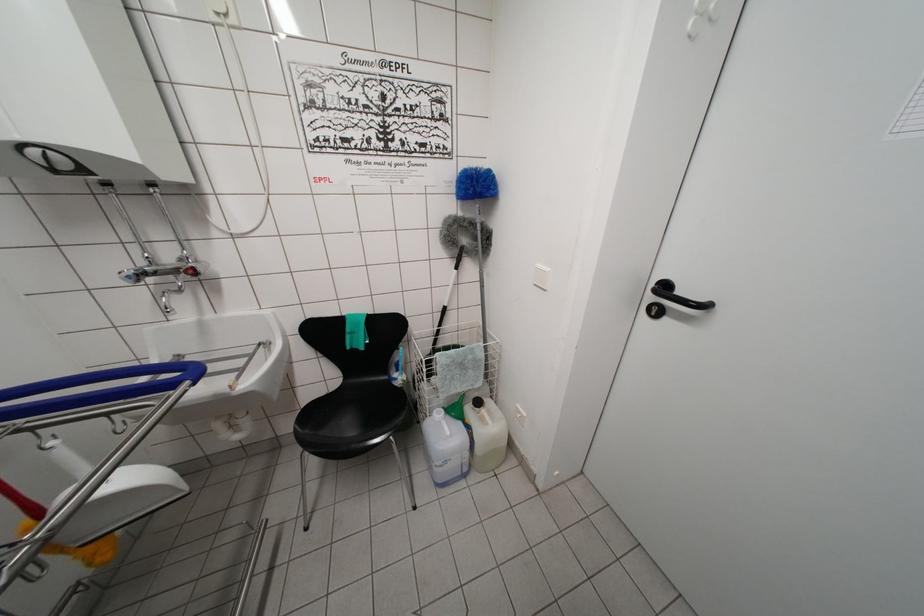
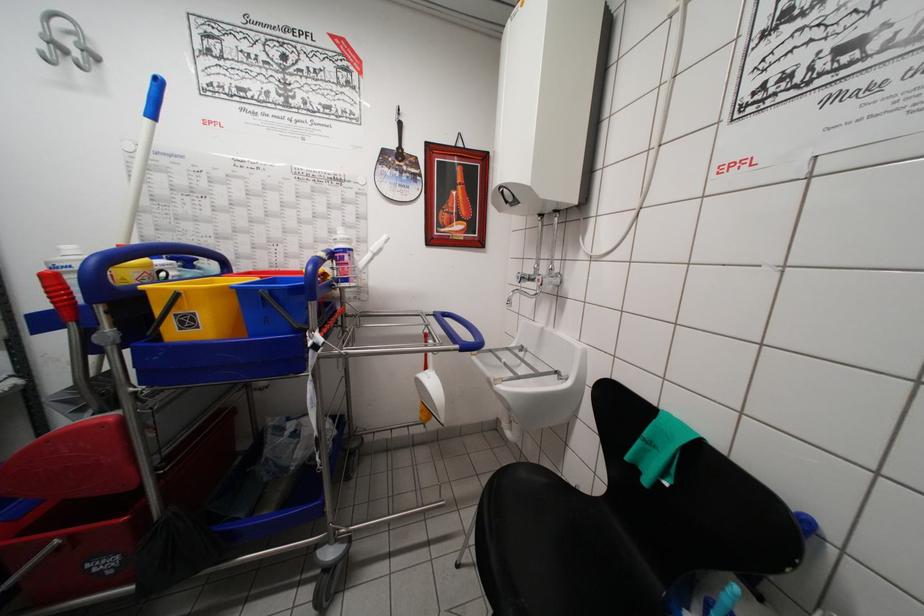
The point at (x=190, y=387) is marked in the first image. Where is the corresponding point in the second image?

(460, 351)